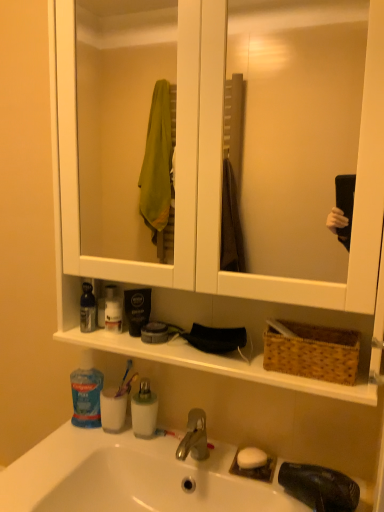
Question: From the image's perspective, is white matte soap at sink below translucent plastic toothbrush at lower center, which is counted as the 1th toothbrush, starting from the left?

Choices:
 (A) no
 (B) yes

Answer: (B)

Question: Considering the relative positions of white matte soap at sink and translucent plastic toothbrush at lower center, which is counted as the 1th toothbrush, starting from the left, in the image provided, is white matte soap at sink to the right of translucent plastic toothbrush at lower center, which is counted as the 1th toothbrush, starting from the left, from the viewer's perspective?

Choices:
 (A) yes
 (B) no

Answer: (A)

Question: Are white matte soap at sink and translucent plastic toothbrush at lower center, which ranks as the 2th toothbrush in right-to-left order, located far from each other?

Choices:
 (A) yes
 (B) no

Answer: (B)

Question: From a real-world perspective, is white matte soap at sink below translucent plastic toothbrush at lower center, placed as the first toothbrush when sorted from back to front?

Choices:
 (A) yes
 (B) no

Answer: (A)

Question: Is the position of white matte soap at sink more distant than that of translucent plastic toothbrush at lower center, which is counted as the 1th toothbrush, starting from the left?

Choices:
 (A) yes
 (B) no

Answer: (B)

Question: Is white matte soap at sink placed right next to translucent plastic toothbrush at lower center, which is the 1th toothbrush in top-to-bottom order?

Choices:
 (A) yes
 (B) no

Answer: (B)

Question: Can you see white plastic toothbrush at center, the 2th toothbrush viewed from the left, touching blue plastic toothpaste at lower left, the first toiletry positioned from the bottom?

Choices:
 (A) yes
 (B) no

Answer: (B)

Question: Is white plastic toothbrush at center, the first toothbrush viewed from the right, closer to camera compared to blue plastic toothpaste at lower left, the first toiletry positioned from the bottom?

Choices:
 (A) no
 (B) yes

Answer: (B)

Question: Could blue plastic toothpaste at lower left, the 2th toiletry positioned from the top, be considered to be inside white plastic toothbrush at center, positioned as the first toothbrush in front-to-back order?

Choices:
 (A) no
 (B) yes

Answer: (A)

Question: Considering the relative sizes of white plastic toothbrush at center, positioned as the first toothbrush in front-to-back order, and blue plastic toothpaste at lower left, the first toiletry positioned from the bottom, in the image provided, is white plastic toothbrush at center, positioned as the first toothbrush in front-to-back order, bigger than blue plastic toothpaste at lower left, the first toiletry positioned from the bottom,?

Choices:
 (A) no
 (B) yes

Answer: (A)

Question: Is white plastic toothbrush at center, the first toothbrush viewed from the right, behind blue plastic toothpaste at lower left, the 2th toiletry positioned from the top?

Choices:
 (A) no
 (B) yes

Answer: (A)

Question: From a real-world perspective, does white plastic toothbrush at center, the second toothbrush when ordered from back to front, sit lower than blue plastic toothpaste at lower left, the 2th toiletry positioned from the top?

Choices:
 (A) yes
 (B) no

Answer: (A)

Question: Is white plastic toothbrush at center, the first toothbrush viewed from the right, wider than blue translucent mouthwash at lower left, the first mouthwash positioned from the left?

Choices:
 (A) no
 (B) yes

Answer: (A)